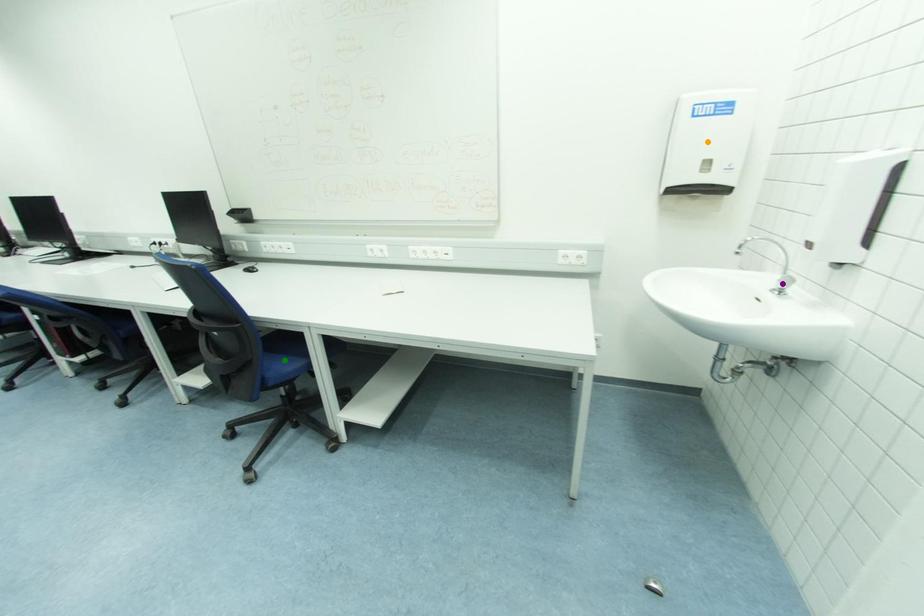
Order these from nearest to farthest:
A) purple point
B) green point
C) orange point

purple point, orange point, green point